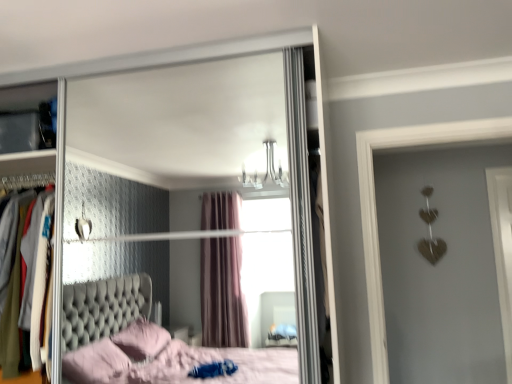
Question: Is metallic silver dresser at left beside clear glass mirror at upper center?

Choices:
 (A) yes
 (B) no

Answer: (B)

Question: Is metallic silver dresser at left thinner than clear glass mirror at upper center?

Choices:
 (A) no
 (B) yes

Answer: (B)

Question: From the image's perspective, is metallic silver dresser at left located beneath clear glass mirror at upper center?

Choices:
 (A) yes
 (B) no

Answer: (A)

Question: Is metallic silver dresser at left oriented away from clear glass mirror at upper center?

Choices:
 (A) yes
 (B) no

Answer: (A)

Question: Is metallic silver dresser at left at the left side of clear glass mirror at upper center?

Choices:
 (A) no
 (B) yes

Answer: (B)

Question: Is metallic silver dresser at left far from clear glass mirror at upper center?

Choices:
 (A) no
 (B) yes

Answer: (B)

Question: Does clear glass mirror at upper center appear on the left side of metallic silver dresser at left?

Choices:
 (A) no
 (B) yes

Answer: (A)

Question: Does clear glass mirror at upper center lie in front of metallic silver dresser at left?

Choices:
 (A) no
 (B) yes

Answer: (B)

Question: From a real-world perspective, is clear glass mirror at upper center positioned under metallic silver dresser at left based on gravity?

Choices:
 (A) yes
 (B) no

Answer: (B)

Question: Can metallic silver dresser at left be found inside clear glass mirror at upper center?

Choices:
 (A) yes
 (B) no

Answer: (A)

Question: Is clear glass mirror at upper center to the right of metallic silver dresser at left from the viewer's perspective?

Choices:
 (A) yes
 (B) no

Answer: (A)

Question: Does clear glass mirror at upper center have a smaller size compared to metallic silver dresser at left?

Choices:
 (A) no
 (B) yes

Answer: (A)

Question: From a real-world perspective, is metallic silver dresser at left positioned above or below clear glass mirror at upper center?

Choices:
 (A) below
 (B) above

Answer: (A)